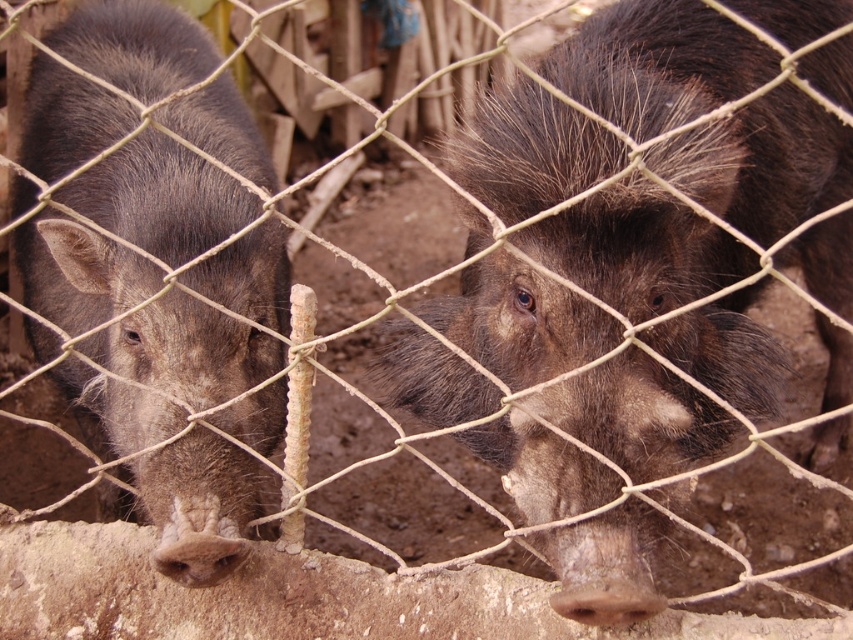
Looking at this image, who is more forward, (602,257) or (117,122)?

Positioned in front is point (602,257).

Between brown fuzzy pig at center and dark brown fur at left, which one appears on the left side from the viewer's perspective?

Positioned to the left is dark brown fur at left.

Who is more forward, [650,582] or [152,470]?

Point [650,582]

At what (x,y) coordinates should I click in order to perform the action: click on brown fuzzy pig at center. Please return your answer as a coordinate pair (x, y). Looking at the image, I should click on (656, 64).